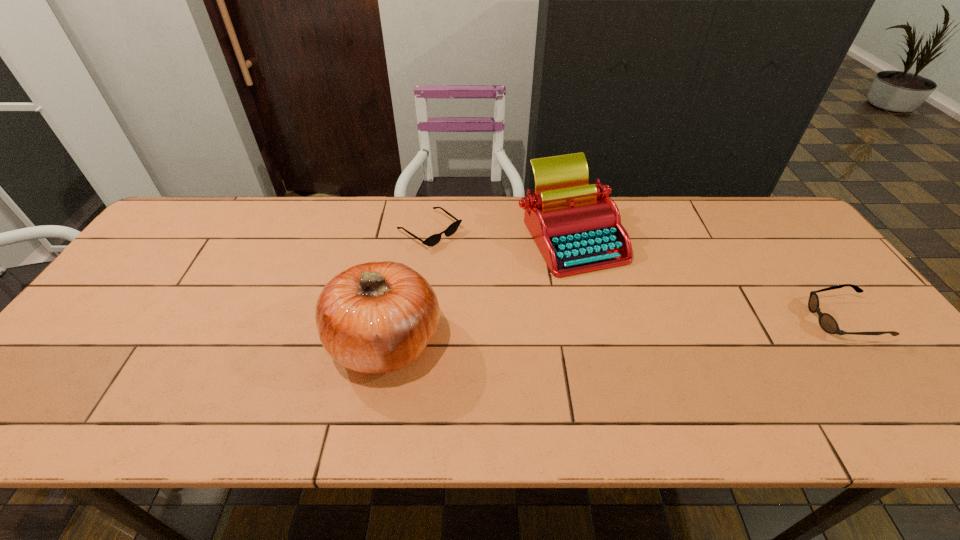
Identify the location of the tallest object. (376, 317).

Where is `the right sunglasses`? The width and height of the screenshot is (960, 540). the right sunglasses is located at coordinates (827, 322).

The image size is (960, 540). Identify the location of the taller sunglasses. (827, 322).

At what (x,y) coordinates should I click in order to perform the action: click on typewriter. Please return your answer as a coordinate pair (x, y). Image resolution: width=960 pixels, height=540 pixels. Looking at the image, I should click on (577, 228).

Locate an element on the screen. the second object from right to left is located at coordinates (577, 228).

This screenshot has height=540, width=960. I want to click on the left sunglasses, so click(434, 239).

You are a GUI agent. You are given a task and a screenshot of the screen. Output one action in this format:
    pyautogui.click(x=<x>, y=<y>)
    Task: Click on the shorter sunglasses
    This screenshot has height=540, width=960.
    Given the screenshot: What is the action you would take?
    pyautogui.click(x=434, y=239)

Locate an element on the screen. Image resolution: width=960 pixels, height=540 pixels. vacant point located on the right of the tallest object is located at coordinates (488, 340).

Locate an element on the screen. Image resolution: width=960 pixels, height=540 pixels. vacant space located 0.150m on the lenses of the rightmost object is located at coordinates (753, 320).

Locate an element on the screen. vacant area located on the lenses of the rightmost object is located at coordinates (745, 320).